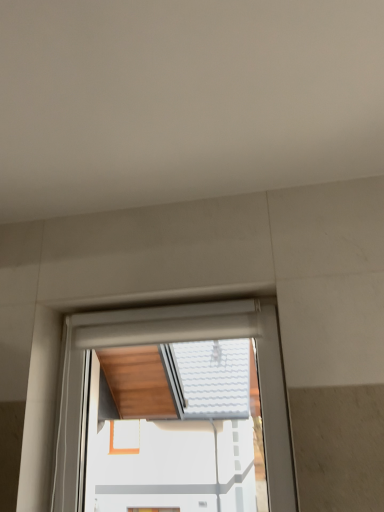
Describe the element at coordinates (173, 341) in the screenshot. I see `white matte window at center` at that location.

Find the location of a particular element. white matte window at center is located at coordinates (173, 341).

You are a GUI agent. You are given a task and a screenshot of the screen. Output one action in this format:
    pyautogui.click(x=<x>, y=<y>)
    Task: Click on the white matte window at center
    The width and height of the screenshot is (384, 512).
    Given the screenshot: What is the action you would take?
    pyautogui.click(x=173, y=341)